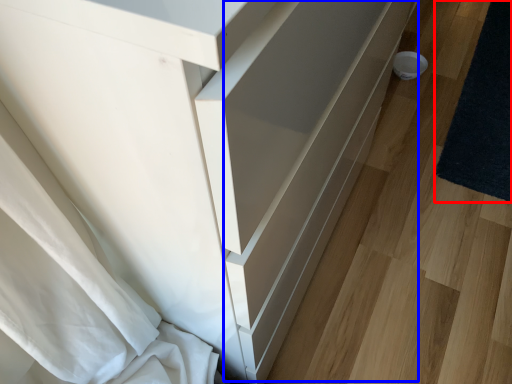
Question: Which of the following is the closest to the observer, mat (highlighted by a red box) or drawer (highlighted by a blue box)?

Choices:
 (A) mat
 (B) drawer

Answer: (B)